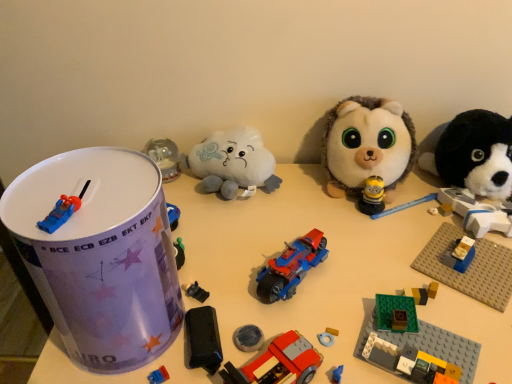
In order to click on vacant space in front of black plastic toy car at center, which is the 6th toy in right-to-left order in this screenshot , I will do `click(197, 359)`.